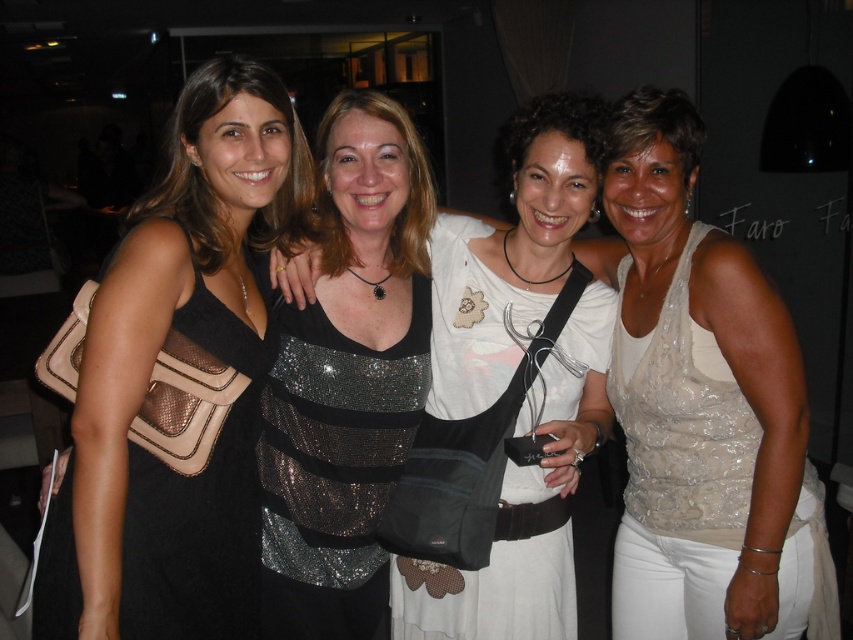
Who is taller, sparkly silver dress at center or black mesh dress at left?

sparkly silver dress at center is taller.

Is sparkly silver dress at center positioned before black mesh dress at left?

No, it is not.

Is point (469, 612) farther from camera compared to point (157, 515)?

That is True.

Find the location of a particular element. sparkly silver dress at center is located at coordinates (511, 252).

Between white sequined top at center and sparkly silver dress at center, which one appears on the left side from the viewer's perspective?

From the viewer's perspective, sparkly silver dress at center appears more on the left side.

Can you confirm if white sequined top at center is thinner than sparkly silver dress at center?

Incorrect, white sequined top at center's width is not less than sparkly silver dress at center's.

The image size is (853, 640). In order to click on white sequined top at center in this screenshot , I will do pos(701,406).

I want to click on white sequined top at center, so click(x=701, y=406).

Is sparkly sequined dress at center further to camera compared to black mesh dress at left?

Yes, it is.

Is point (282, 461) positioned after point (262, 378)?

Yes.

Where is `sparkly sequined dress at center`? The height and width of the screenshot is (640, 853). sparkly sequined dress at center is located at coordinates (334, 467).